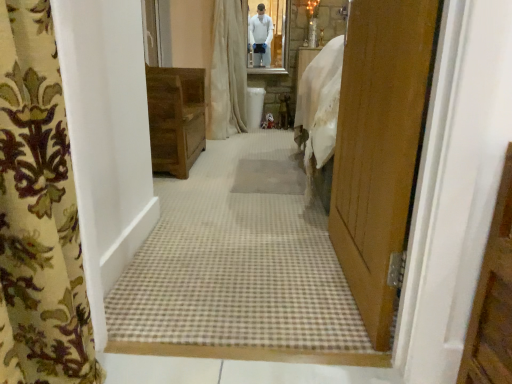
Image resolution: width=512 pixels, height=384 pixels. I want to click on wooden cabinet at center, so click(175, 118).

What is the approximate height of beige fabric curtain at center, which appears as the second curtain when viewed from the front?

The height of beige fabric curtain at center, which appears as the second curtain when viewed from the front, is 4.37 feet.

What is the approximate width of floral fabric curtain at left, the second curtain viewed from the top?

floral fabric curtain at left, the second curtain viewed from the top, is 6.95 inches in width.

I want to click on floral fabric curtain at left, the second curtain viewed from the top, so click(39, 213).

Image resolution: width=512 pixels, height=384 pixels. What are the coordinates of `wooden door at right` in the screenshot? It's located at (380, 148).

Locate an element on the screen. Image resolution: width=512 pixels, height=384 pixels. wooden cabinet at center is located at coordinates (175, 118).

Is beige textured mat at center directly adjacent to floral fabric curtain at left, the second curtain viewed from the top?

No, beige textured mat at center is not in contact with floral fabric curtain at left, the second curtain viewed from the top.

Who is bigger, beige textured mat at center or floral fabric curtain at left, the second curtain viewed from the top?

Bigger between the two is floral fabric curtain at left, the second curtain viewed from the top.

Can we say beige textured mat at center lies outside floral fabric curtain at left, the 2th curtain positioned from the back?

Yes, beige textured mat at center is outside of floral fabric curtain at left, the 2th curtain positioned from the back.

Is wooden door at right oriented towards beige textured mat at center?

No, wooden door at right does not turn towards beige textured mat at center.

The image size is (512, 384). I want to click on door positioned vertically above the beige textured mat at center (from a real-world perspective), so click(380, 148).

From the picture: Can beige textured mat at center be found inside wooden door at right?

Definitely not — beige textured mat at center is not inside wooden door at right.

Measure the distance between wooden door at right and beige textured mat at center.

3.62 feet.

Is wooden door at right smaller than wooden cabinet at center?

Indeed, wooden door at right has a smaller size compared to wooden cabinet at center.

Is wooden door at right shorter than wooden cabinet at center?

In fact, wooden door at right may be taller than wooden cabinet at center.

From a real-world perspective, which is physically above, floral fabric curtain at left, marked as the first curtain in a bottom-to-top arrangement, or wooden cabinet at center?

floral fabric curtain at left, marked as the first curtain in a bottom-to-top arrangement.

The height and width of the screenshot is (384, 512). I want to click on curtain that is the 1st one above the wooden cabinet at center (from a real-world perspective), so click(x=39, y=213).

Is floral fabric curtain at left, the second curtain viewed from the top, inside the boundaries of wooden cabinet at center, or outside?

floral fabric curtain at left, the second curtain viewed from the top, is not inside wooden cabinet at center, it's outside.

Which is less distant, (276, 181) or (417, 76)?

The point (417, 76) is closer.

Based on the photo, is wooden door at right inside beige textured mat at center?

No, wooden door at right is located outside of beige textured mat at center.

Is beige textured mat at center positioned with its back to wooden door at right?

No, wooden door at right is not at the back of beige textured mat at center.

Identify the location of mat that is below the wooden door at right (from the image's perspective). (269, 176).

In the scene shown: Which of these two, wooden cabinet at center or beige fabric curtain at center, which appears as the second curtain when viewed from the front, is bigger?

With larger size is beige fabric curtain at center, which appears as the second curtain when viewed from the front.

Does wooden cabinet at center appear on the right side of beige fabric curtain at center, which ranks as the first curtain in top-to-bottom order?

Incorrect, wooden cabinet at center is not on the right side of beige fabric curtain at center, which ranks as the first curtain in top-to-bottom order.

Between wooden cabinet at center and beige fabric curtain at center, which appears as the second curtain when viewed from the front, which one is positioned behind?

Positioned behind is beige fabric curtain at center, which appears as the second curtain when viewed from the front.

Is beige fabric curtain at center, marked as the 1th curtain in a back-to-front arrangement, completely or partially inside wooden cabinet at center?

No, beige fabric curtain at center, marked as the 1th curtain in a back-to-front arrangement, is not inside wooden cabinet at center.

The image size is (512, 384). Identify the location of furniture above the beige carpet at center (from the image's perspective). (175, 118).

Based on the photo, measure the distance from beige carpet at center to wooden cabinet at center.

31.13 inches.

Between beige carpet at center and wooden cabinet at center, which one is positioned behind?

wooden cabinet at center.

Can you confirm if beige carpet at center is smaller than wooden cabinet at center?

Incorrect, beige carpet at center is not smaller in size than wooden cabinet at center.

Find the location of a particular element. curtain that appears below the beige textured mat at center (from the image's perspective) is located at coordinates 39,213.

In the image, there is a wooden door at right. Where is `mat below it (from a real-world perspective)`? The height and width of the screenshot is (384, 512). mat below it (from a real-world perspective) is located at coordinates (269, 176).

Based on their spatial positions, is floral fabric curtain at left, the second curtain viewed from the top, or beige textured mat at center further from beige carpet at center?

The object further to beige carpet at center is floral fabric curtain at left, the second curtain viewed from the top.

Looking at the image, which one is located closer to wooden door at right, wooden cabinet at center or beige carpet at center?

beige carpet at center lies closer to wooden door at right than the other object.

Considering their positions, is beige fabric curtain at center, marked as the 1th curtain in a back-to-front arrangement, positioned further to beige textured mat at center than wooden door at right?

beige fabric curtain at center, marked as the 1th curtain in a back-to-front arrangement, is positioned further to the anchor beige textured mat at center.

Considering their positions, is wooden door at right positioned closer to wooden cabinet at center than floral fabric curtain at left, the 2th curtain positioned from the back?

wooden door at right is positioned closer to the anchor wooden cabinet at center.

Considering their positions, is beige carpet at center positioned closer to wooden cabinet at center than wooden door at right?

beige carpet at center is closer to wooden cabinet at center.

Based on the photo, looking at the image, which one is located closer to beige textured mat at center, wooden cabinet at center or floral fabric curtain at left, the second curtain viewed from the top?

wooden cabinet at center.

Based on their spatial positions, is beige textured mat at center or wooden cabinet at center closer to floral fabric curtain at left, the 2th curtain positioned from the back?

The object closer to floral fabric curtain at left, the 2th curtain positioned from the back, is beige textured mat at center.

Considering their positions, is floral fabric curtain at left, the second curtain viewed from the top, positioned further to wooden cabinet at center than beige carpet at center?

floral fabric curtain at left, the second curtain viewed from the top.

I want to click on furniture located between wooden door at right and beige fabric curtain at center, which appears as the second curtain when viewed from the front, in the depth direction, so click(x=175, y=118).

Locate an element on the screen. This screenshot has width=512, height=384. furniture located between floral fabric curtain at left, the second curtain viewed from the top, and beige fabric curtain at center, which appears as the second curtain when viewed from the front, in the depth direction is located at coordinates (175, 118).

You are a GUI agent. You are given a task and a screenshot of the screen. Output one action in this format:
    pyautogui.click(x=<x>, y=<y>)
    Task: Click on the mat between wooden door at right and beige fabric curtain at center, marked as the 1th curtain in a back-to-front arrangement, from front to back
    
    Given the screenshot: What is the action you would take?
    pyautogui.click(x=269, y=176)

Locate an element on the screen. door between floral fabric curtain at left, marked as the first curtain in a bottom-to-top arrangement, and beige fabric curtain at center, which is the second curtain in bottom-to-top order, from front to back is located at coordinates (380, 148).